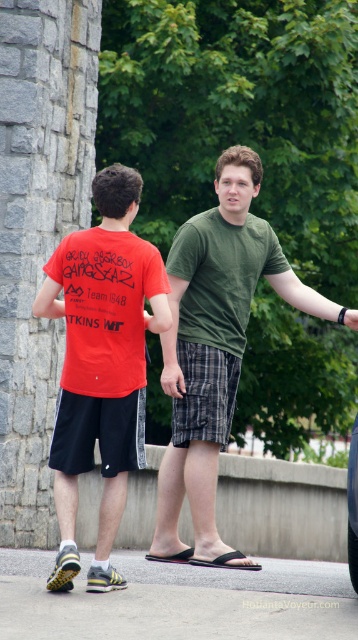
Question: Is shiny black car at center thinner than black matte wristband at upper right?

Choices:
 (A) no
 (B) yes

Answer: (A)

Question: Which object is the farthest from the shiny black car at center?

Choices:
 (A) matte red t-shirt at center
 (B) black matte wristband at upper right

Answer: (A)

Question: Which of the following is the closest to the observer?

Choices:
 (A) 171,365
 (B) 245,205
 (C) 346,312
 (D) 352,525

Answer: (D)

Question: Which object is farther from the camera taking this photo?

Choices:
 (A) matte black hand at center
 (B) matte red t-shirt at center
 (C) black matte wristband at upper right
 (D) shiny black car at center

Answer: (A)

Question: Observing the image, what is the correct spatial positioning of matte red t-shirt at center in reference to black matte wristband at upper right?

Choices:
 (A) above
 (B) below

Answer: (B)

Question: Can you confirm if green cotton shirt at center is positioned to the right of shiny black car at center?

Choices:
 (A) no
 (B) yes

Answer: (A)